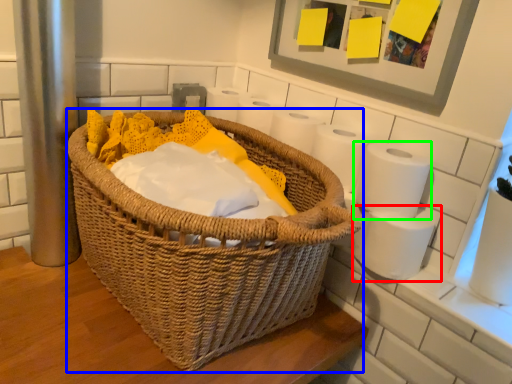
Question: Which object is positioned closest to toilet paper (highlighted by a red box)? Select from picnic basket (highlighted by a blue box) and toilet paper (highlighted by a green box).

Choices:
 (A) picnic basket
 (B) toilet paper

Answer: (B)